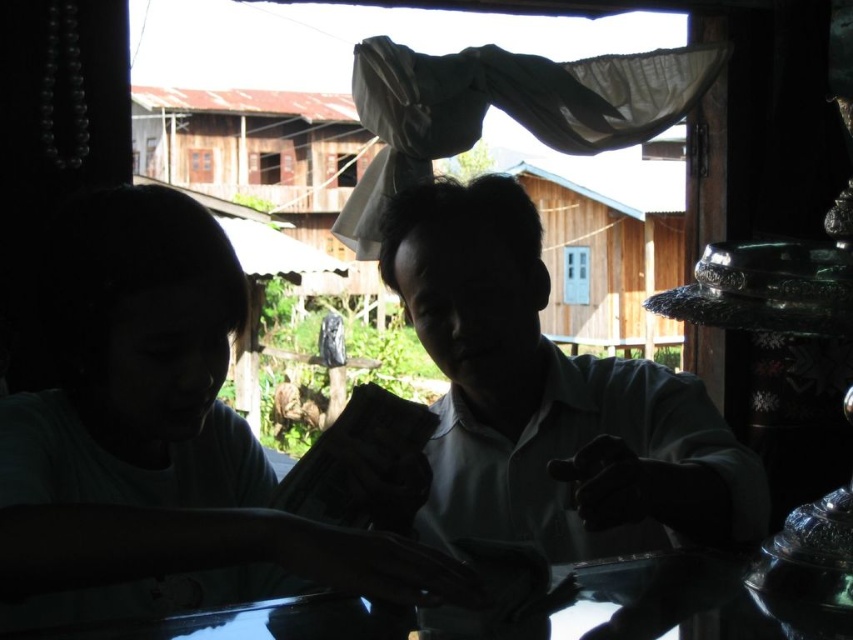
Who is positioned more to the right, white glossy shirt at center or glossy glass table at lower center?

Positioned to the right is white glossy shirt at center.

Who is higher up, white glossy shirt at center or glossy glass table at lower center?

white glossy shirt at center is higher up.

Is point (424, 252) closer to viewer compared to point (274, 628)?

That is False.

The image size is (853, 640). Identify the location of white glossy shirt at center. (550, 401).

Can you confirm if light green t-shirt at left is smaller than white glossy shirt at center?

Correct, light green t-shirt at left occupies less space than white glossy shirt at center.

Does light green t-shirt at left have a greater height compared to white glossy shirt at center?

No, light green t-shirt at left is not taller than white glossy shirt at center.

Measure the distance between light green t-shirt at left and camera.

light green t-shirt at left is 26.38 inches away from camera.

This screenshot has height=640, width=853. I want to click on light green t-shirt at left, so pos(158,440).

Who is positioned more to the left, light green t-shirt at left or glossy glass table at lower center?

light green t-shirt at left

Describe the element at coordinates (158, 440) in the screenshot. The width and height of the screenshot is (853, 640). I see `light green t-shirt at left` at that location.

Where is `light green t-shirt at left`? This screenshot has height=640, width=853. light green t-shirt at left is located at coordinates (158, 440).